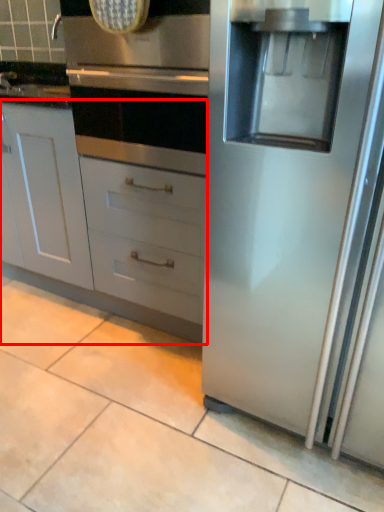
Question: Where is cabinetry (annotated by the red box) located in relation to oven in the image?

Choices:
 (A) left
 (B) right

Answer: (A)